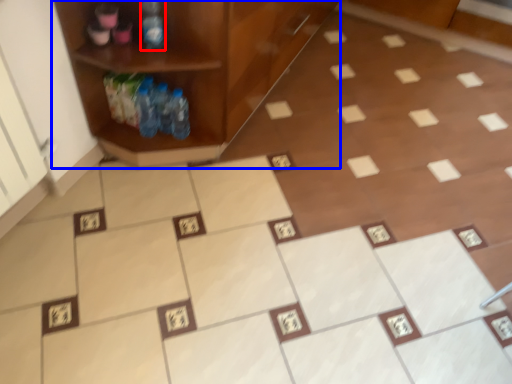
Question: Among these objects, which one is nearest to the camera, bottle (highlighted by a red box) or shelf (highlighted by a blue box)?

Choices:
 (A) bottle
 (B) shelf

Answer: (B)